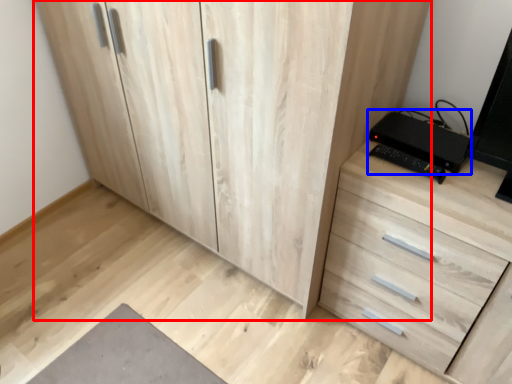
Question: Which of the following is the farthest to the observer, cupboard (highlighted by a red box) or computer (highlighted by a blue box)?

Choices:
 (A) cupboard
 (B) computer

Answer: (B)